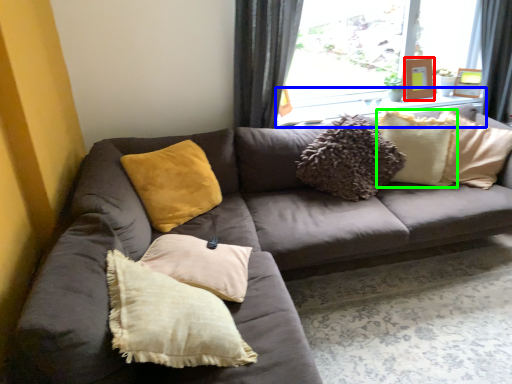
Question: Which is farther away from picture frame (highlighted by a red box)? window sill (highlighted by a blue box) or pillow (highlighted by a green box)?

Choices:
 (A) window sill
 (B) pillow

Answer: (B)